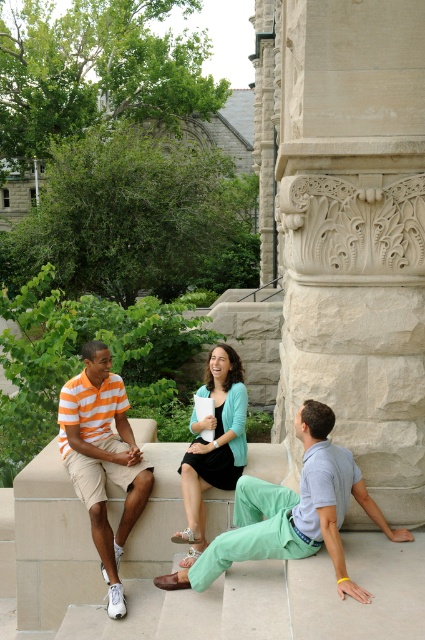
Is light green cotton pants at center to the left of teal jersey at center from the viewer's perspective?

In fact, light green cotton pants at center is to the right of teal jersey at center.

Which of these two, light green cotton pants at center or teal jersey at center, stands taller?

Standing taller between the two is teal jersey at center.

Which is in front, point (280, 541) or point (231, 465)?

Positioned in front is point (280, 541).

Locate an element on the screen. The height and width of the screenshot is (640, 425). light green cotton pants at center is located at coordinates (291, 513).

Based on the photo, can you confirm if light green cotton pants at center is positioned above orange striped shirt at left?

No.

You are a GUI agent. You are given a task and a screenshot of the screen. Output one action in this format:
    pyautogui.click(x=<x>, y=<y>)
    Task: Click on the light green cotton pants at center
    The width and height of the screenshot is (425, 640).
    Given the screenshot: What is the action you would take?
    pyautogui.click(x=291, y=513)

Who is taller, orange striped shirt at left or teal jersey at center?

orange striped shirt at left

Based on the photo, can you confirm if orange striped shirt at left is positioned below teal jersey at center?

Indeed, orange striped shirt at left is positioned under teal jersey at center.

Find the location of `orange striped shirt at left`. orange striped shirt at left is located at coordinates (102, 458).

Where is `orange striped shirt at left`? orange striped shirt at left is located at coordinates (x=102, y=458).